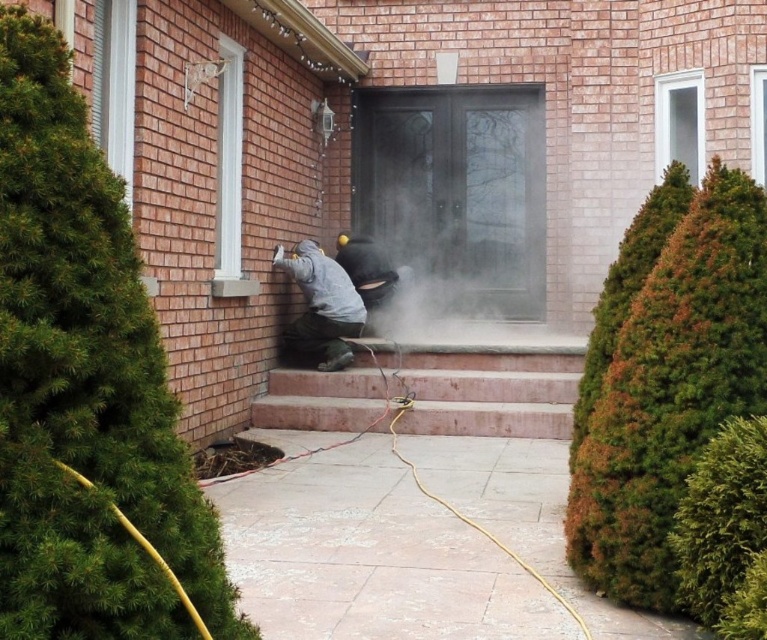
In the scene shown: You are a delivery person trying to reach the front door of the brick house. You see the pink concrete stairs at center and the gray matte jacket at center. Which object is closer to the front door?

The pink concrete stairs at center is positioned under the gray matte jacket at center, meaning it is closer to the front door than the gray matte jacket at center.